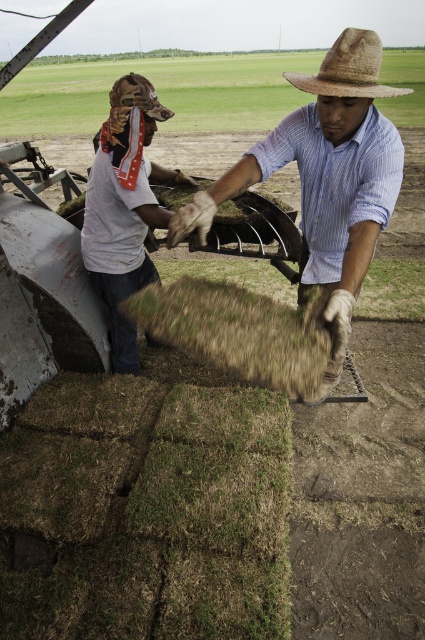
Question: Which is nearer to the white cotton shirt at left?

Choices:
 (A) brown straw hat at center
 (B) brown straw cowboy hat at upper left
 (C) straw hat at upper center

Answer: (B)

Question: Estimate the real-world distances between objects in this image. Which object is farther from the straw hat at upper center?

Choices:
 (A) white cotton shirt at left
 (B) brown straw hat at center
 (C) brown straw cowboy hat at upper left

Answer: (A)

Question: Is white cotton shirt at left below brown straw cowboy hat at upper left?

Choices:
 (A) yes
 (B) no

Answer: (A)

Question: Is brown straw hat at center bigger than straw hat at upper center?

Choices:
 (A) yes
 (B) no

Answer: (A)

Question: Where is white cotton shirt at left located in relation to straw hat at upper center in the image?

Choices:
 (A) left
 (B) right

Answer: (A)

Question: Estimate the real-world distances between objects in this image. Which object is closer to the brown straw hat at center?

Choices:
 (A) brown straw cowboy hat at upper left
 (B) white cotton shirt at left
 (C) straw hat at upper center

Answer: (C)